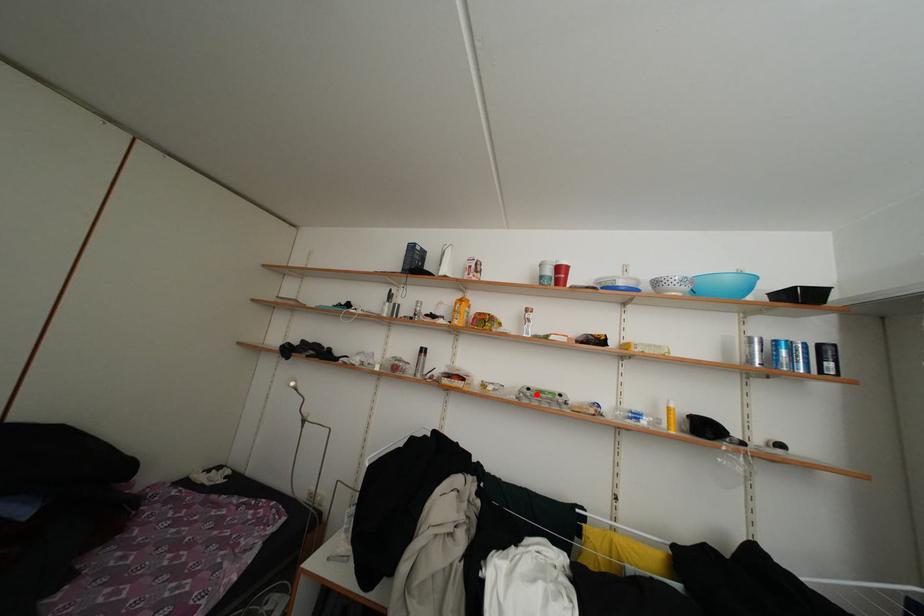
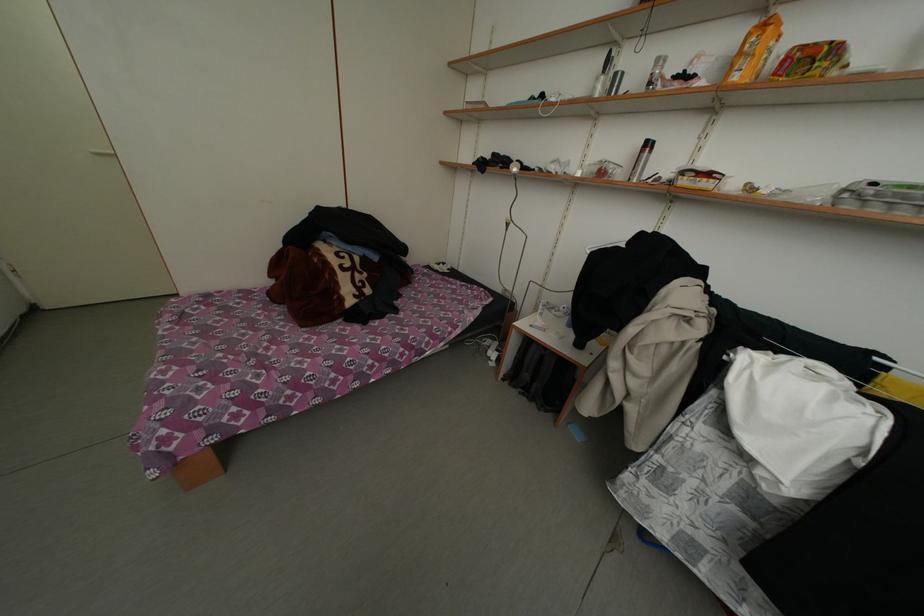
Question: A red point is marked in image1. In image2, is the corresponding 3D point closer to the camera or farther? Reply with the corresponding letter.

Choices:
 (A) The corresponding 3D point is closer.
 (B) The corresponding 3D point is farther.

Answer: (B)